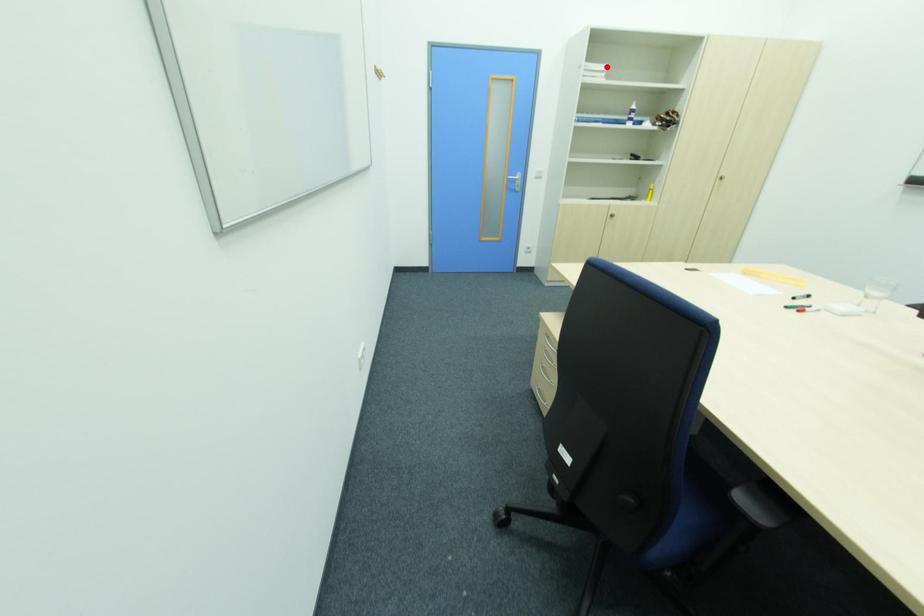
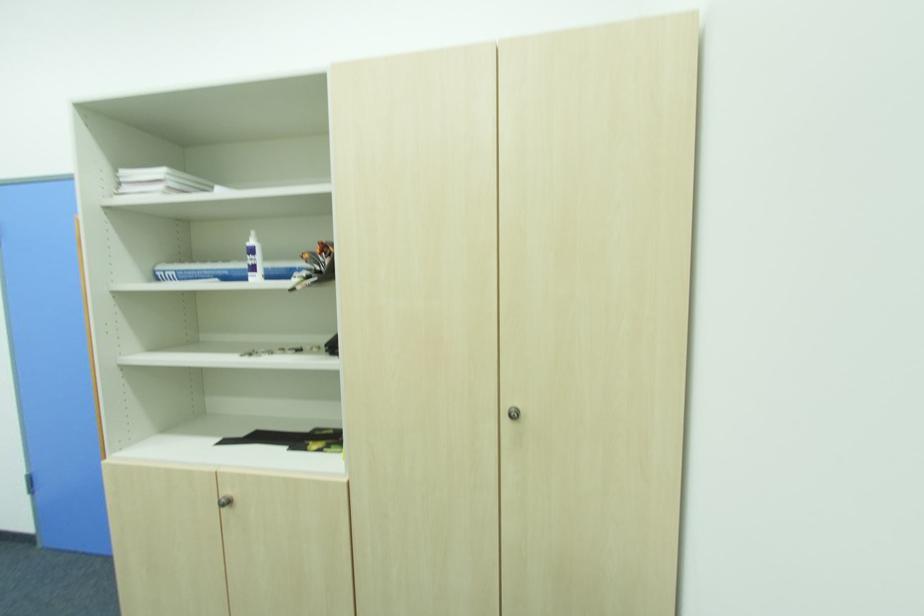
Question: I am providing you with two images of the same scene from different viewpoints. A red point is marked on the first image. At the location where the point appears in image 1, is it still visible in image 2?

Choices:
 (A) Yes
 (B) No

Answer: (A)